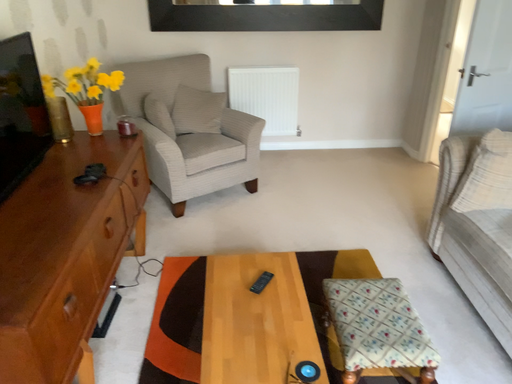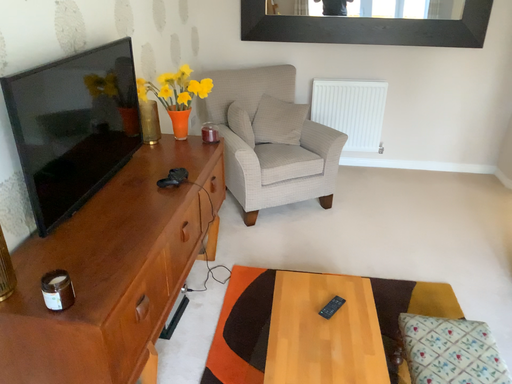
Question: Which way did the camera rotate in the video?

Choices:
 (A) rotated right
 (B) rotated left

Answer: (B)